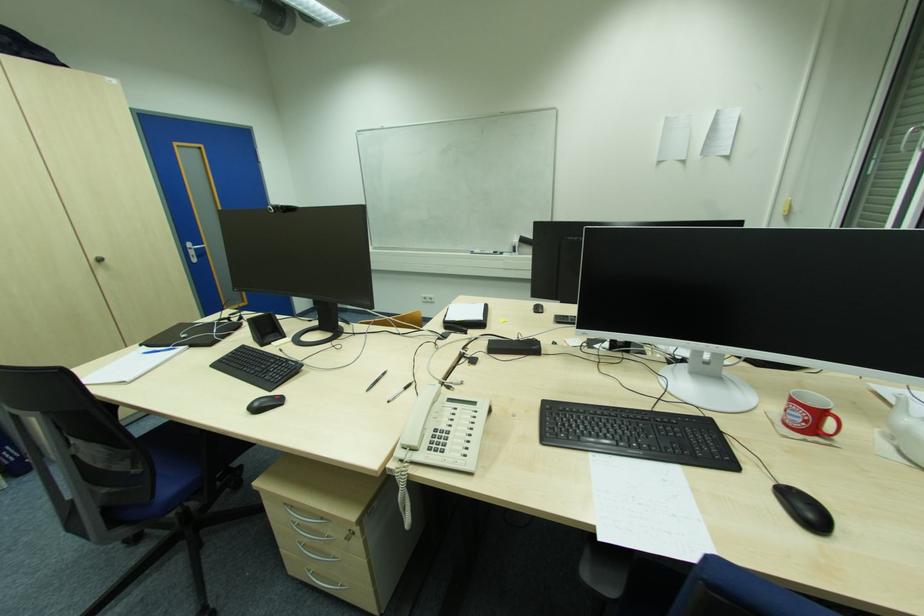
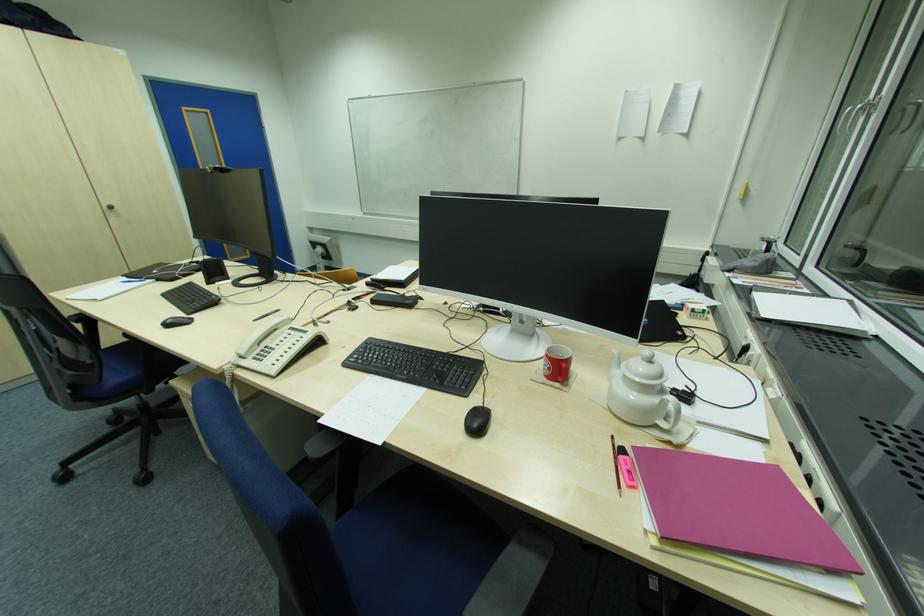
Find the pixel in the second image that matches [438,452] in the first image.

(259, 361)